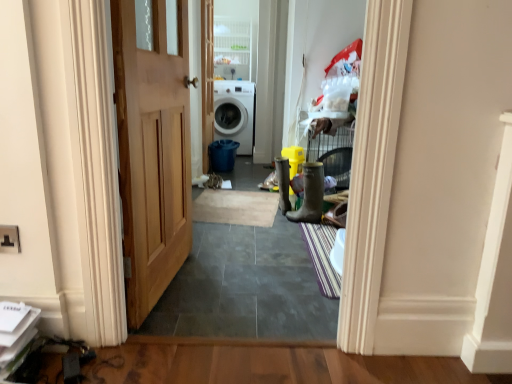
Question: Is rubber boot at center, placed as the 1th boot when sorted from left to right, facing towards beige carpet at center, acting as the 1th doormat starting from the back?

Choices:
 (A) yes
 (B) no

Answer: (B)

Question: Is rubber boot at center, the 2th boot from the right, facing away from beige carpet at center, which is the 2th doormat in front-to-back order?

Choices:
 (A) no
 (B) yes

Answer: (A)

Question: Would you say rubber boot at center, which appears as the 2th boot when viewed from the front, is outside beige carpet at center, the second doormat in the right-to-left sequence?

Choices:
 (A) no
 (B) yes

Answer: (B)

Question: Is rubber boot at center, placed as the 1th boot when sorted from left to right, at the left side of beige carpet at center, acting as the 1th doormat starting from the back?

Choices:
 (A) no
 (B) yes

Answer: (A)

Question: Is the surface of rubber boot at center, which appears as the 2th boot when viewed from the front, in direct contact with beige carpet at center, positioned as the 1th doormat in left-to-right order?

Choices:
 (A) yes
 (B) no

Answer: (B)

Question: Looking at their shapes, would you say beige carpet at center, positioned as the 1th doormat in left-to-right order, is wider or thinner than striped fabric doormat at center, placed as the 2th doormat when sorted from left to right?

Choices:
 (A) wide
 (B) thin

Answer: (A)

Question: Visually, is beige carpet at center, acting as the 1th doormat starting from the back, positioned to the left or to the right of striped fabric doormat at center, the first doormat positioned from the front?

Choices:
 (A) right
 (B) left

Answer: (B)

Question: Is beige carpet at center, which is the 2th doormat in front-to-back order, inside or outside of striped fabric doormat at center, placed as the 2th doormat when sorted from left to right?

Choices:
 (A) inside
 (B) outside

Answer: (B)

Question: Relative to striped fabric doormat at center, marked as the 1th doormat in a right-to-left arrangement, is beige carpet at center, the second doormat in the right-to-left sequence, in front or behind?

Choices:
 (A) front
 (B) behind

Answer: (B)

Question: Considering the positions of rubber/matte boot at right, which is the first boot from front to back, and striped fabric doormat at center, marked as the 1th doormat in a right-to-left arrangement, in the image, is rubber/matte boot at right, which is the first boot from front to back, wider or thinner than striped fabric doormat at center, marked as the 1th doormat in a right-to-left arrangement,?

Choices:
 (A) wide
 (B) thin

Answer: (B)

Question: Visually, is rubber/matte boot at right, placed as the second boot when sorted from left to right, positioned to the left or to the right of striped fabric doormat at center, which is counted as the 2th doormat, starting from the back?

Choices:
 (A) right
 (B) left

Answer: (B)

Question: Is rubber/matte boot at right, which is the first boot from front to back, spatially inside striped fabric doormat at center, marked as the 1th doormat in a right-to-left arrangement, or outside of it?

Choices:
 (A) inside
 (B) outside

Answer: (B)

Question: Considering the positions of point (297, 208) and point (313, 249), is point (297, 208) closer or farther from the camera than point (313, 249)?

Choices:
 (A) closer
 (B) farther

Answer: (B)

Question: From a real-world perspective, is striped fabric doormat at center, placed as the 2th doormat when sorted from left to right, positioned above or below beige carpet at center, marked as the first doormat in a top-to-bottom arrangement?

Choices:
 (A) below
 (B) above

Answer: (A)

Question: Considering the positions of striped fabric doormat at center, marked as the 1th doormat in a right-to-left arrangement, and beige carpet at center, positioned as the 1th doormat in left-to-right order, in the image, is striped fabric doormat at center, marked as the 1th doormat in a right-to-left arrangement, wider or thinner than beige carpet at center, positioned as the 1th doormat in left-to-right order,?

Choices:
 (A) thin
 (B) wide

Answer: (A)